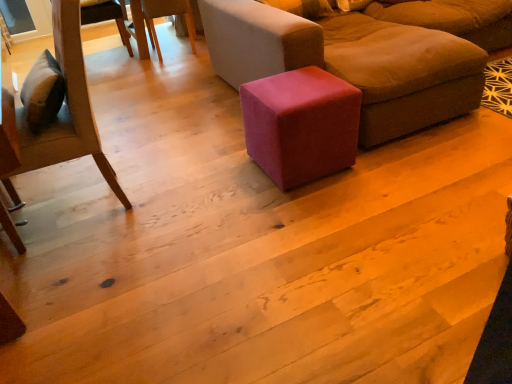
This screenshot has width=512, height=384. What do you see at coordinates (352, 62) in the screenshot?
I see `velvet brown ottoman at center` at bounding box center [352, 62].

What is the approximate height of wooden chair at left, positioned as the second chair in top-to-bottom order?

wooden chair at left, positioned as the second chair in top-to-bottom order, is 38.51 inches tall.

This screenshot has height=384, width=512. What do you see at coordinates (158, 17) in the screenshot? I see `wooden chair at upper left, marked as the second chair in a front-to-back arrangement` at bounding box center [158, 17].

Identify the location of velvet brown ottoman at center. The image size is (512, 384). (352, 62).

Which point is more distant from viewer, (457,47) or (271,174)?

The point (457,47) is farther from the camera.

How distant is velvet brown ottoman at center from velvet pink cube at center?

A distance of 16.63 inches exists between velvet brown ottoman at center and velvet pink cube at center.

From the image's perspective, would you say velvet brown ottoman at center is shown under velvet pink cube at center?

No, from the image's perspective, velvet brown ottoman at center is not beneath velvet pink cube at center.

What's the angular difference between velvet brown ottoman at center and velvet pink cube at center's facing directions?

The angular difference between velvet brown ottoman at center and velvet pink cube at center is 87.5 degrees.

Is velvet pink cube at center behind velvet brown ottoman at center?

Yes, it is behind velvet brown ottoman at center.

Can you confirm if velvet pink cube at center is positioned to the right of velvet brown ottoman at center?

No.

Is velvet pink cube at center next to velvet brown ottoman at center and touching it?

There is a gap between velvet pink cube at center and velvet brown ottoman at center.

Based on their sizes in the image, would you say velvet brown ottoman at center is bigger or smaller than wooden chair at left, which is the first chair from bottom to top?

Considering their sizes, velvet brown ottoman at center takes up more space than wooden chair at left, which is the first chair from bottom to top.

Would you say velvet brown ottoman at center is outside wooden chair at left, which is the first chair from bottom to top?

Yes, velvet brown ottoman at center is located beyond the bounds of wooden chair at left, which is the first chair from bottom to top.

Is velvet brown ottoman at center turned away from wooden chair at left, positioned as the second chair in top-to-bottom order?

No, velvet brown ottoman at center is not facing away from wooden chair at left, positioned as the second chair in top-to-bottom order.

From a real-world perspective, who is located higher, velvet brown ottoman at center or wooden chair at left, positioned as the second chair in top-to-bottom order?

wooden chair at left, positioned as the second chair in top-to-bottom order, is physically above.

Which point is more distant from viewer, [20,152] or [405,48]?

The point [405,48] is more distant.

Is wooden chair at left, which is the first chair from bottom to top, wider or thinner than velvet brown ottoman at center?

In the image, wooden chair at left, which is the first chair from bottom to top, appears to be more narrow than velvet brown ottoman at center.

Looking at the image, does wooden chair at left, positioned as the second chair in top-to-bottom order, seem bigger or smaller compared to velvet brown ottoman at center?

Considering their sizes, wooden chair at left, positioned as the second chair in top-to-bottom order, takes up less space than velvet brown ottoman at center.

Consider the image. How many degrees apart are the facing directions of wooden chair at left, which is the first chair from bottom to top, and wooden chair at upper left, marked as the second chair in a front-to-back arrangement?

There is a 99.1-degree angle between the facing directions of wooden chair at left, which is the first chair from bottom to top, and wooden chair at upper left, marked as the second chair in a front-to-back arrangement.

Is wooden chair at left, the second chair in the back-to-front sequence, oriented towards wooden chair at upper left, the 1th chair positioned from the back?

No, wooden chair at left, the second chair in the back-to-front sequence, is not oriented towards wooden chair at upper left, the 1th chair positioned from the back.

Could you measure the distance between wooden chair at left, the second chair in the back-to-front sequence, and wooden chair at upper left, the 1th chair positioned from the back?

wooden chair at left, the second chair in the back-to-front sequence, and wooden chair at upper left, the 1th chair positioned from the back, are 2.27 meters apart.

Does wooden chair at left, the second chair in the back-to-front sequence, have a greater width compared to wooden chair at upper left, placed as the 2th chair when sorted from bottom to top?

Yes, wooden chair at left, the second chair in the back-to-front sequence, is wider than wooden chair at upper left, placed as the 2th chair when sorted from bottom to top.

Does point (161, 7) appear closer or farther from the camera than point (462, 39)?

Point (161, 7).

Which object is further away from the camera, wooden chair at upper left, the 1th chair positioned from the back, or velvet brown ottoman at center?

wooden chair at upper left, the 1th chair positioned from the back, is behind.

Who is smaller, wooden chair at upper left, the 1th chair positioned from the top, or velvet brown ottoman at center?

Smaller between the two is wooden chair at upper left, the 1th chair positioned from the top.

Is wooden chair at upper left, the 1th chair positioned from the top, looking in the opposite direction of velvet brown ottoman at center?

No, wooden chair at upper left, the 1th chair positioned from the top, is not facing the opposite direction of velvet brown ottoman at center.

From the image's perspective, between wooden chair at upper left, placed as the 2th chair when sorted from bottom to top, and velvet pink cube at center, which one is located above?

wooden chair at upper left, placed as the 2th chair when sorted from bottom to top.

Does wooden chair at upper left, the 1th chair positioned from the back, have a greater width compared to velvet pink cube at center?

Yes, wooden chair at upper left, the 1th chair positioned from the back, is wider than velvet pink cube at center.

Are wooden chair at upper left, the 1th chair positioned from the back, and velvet pink cube at center far apart?

Yes.

Is wooden chair at upper left, the 1th chair positioned from the back, positioned behind velvet pink cube at center?

Yes, the depth of wooden chair at upper left, the 1th chair positioned from the back, is greater than that of velvet pink cube at center.

I want to click on stool on the left of velvet brown ottoman at center, so click(301, 125).

Where is `studio couch above the velvet pink cube at center (from a real-world perspective)`? studio couch above the velvet pink cube at center (from a real-world perspective) is located at coordinates (352, 62).

When comparing their distances from velvet pink cube at center, does velvet brown ottoman at center or wooden chair at upper left, marked as the second chair in a front-to-back arrangement, seem further?

wooden chair at upper left, marked as the second chair in a front-to-back arrangement.

Considering their positions, is velvet brown ottoman at center positioned further to velvet pink cube at center than wooden chair at left, positioned as the second chair in top-to-bottom order?

wooden chair at left, positioned as the second chair in top-to-bottom order, is positioned further to the anchor velvet pink cube at center.

Which object lies further to the anchor point wooden chair at left, the second chair in the back-to-front sequence, wooden chair at upper left, the 1th chair positioned from the back, or velvet brown ottoman at center?

wooden chair at upper left, the 1th chair positioned from the back, is positioned further to the anchor wooden chair at left, the second chair in the back-to-front sequence.

From the image, which object appears to be nearer to wooden chair at left, which appears as the 1th chair when viewed from the front, velvet brown ottoman at center or wooden chair at upper left, the 1th chair positioned from the top?

The object closer to wooden chair at left, which appears as the 1th chair when viewed from the front, is velvet brown ottoman at center.

Estimate the real-world distances between objects in this image. Which object is closer to velvet brown ottoman at center, wooden chair at left, which appears as the 1th chair when viewed from the front, or wooden chair at upper left, the 1th chair positioned from the top?

wooden chair at left, which appears as the 1th chair when viewed from the front, is positioned closer to the anchor velvet brown ottoman at center.

In the scene shown: Considering their positions, is velvet pink cube at center positioned further to wooden chair at left, which appears as the 1th chair when viewed from the front, than velvet brown ottoman at center?

velvet brown ottoman at center.

When comparing their distances from wooden chair at upper left, placed as the 2th chair when sorted from bottom to top, does velvet brown ottoman at center or velvet pink cube at center seem further?

Among the two, velvet pink cube at center is located further to wooden chair at upper left, placed as the 2th chair when sorted from bottom to top.

From the image, which object appears to be farther from wooden chair at left, which is the first chair from bottom to top, wooden chair at upper left, marked as the second chair in a front-to-back arrangement, or velvet pink cube at center?

The object further to wooden chair at left, which is the first chair from bottom to top, is wooden chair at upper left, marked as the second chair in a front-to-back arrangement.

Locate an element on the screen. This screenshot has width=512, height=384. stool between wooden chair at left, the second chair in the back-to-front sequence, and velvet brown ottoman at center, in the horizontal direction is located at coordinates (301, 125).

Where is `stool between wooden chair at left, which appears as the 1th chair when viewed from the front, and wooden chair at upper left, the 1th chair positioned from the top, in the front-back direction`? Image resolution: width=512 pixels, height=384 pixels. stool between wooden chair at left, which appears as the 1th chair when viewed from the front, and wooden chair at upper left, the 1th chair positioned from the top, in the front-back direction is located at coordinates (301, 125).

Find the location of a particular element. This screenshot has width=512, height=384. studio couch between wooden chair at left, the second chair in the back-to-front sequence, and wooden chair at upper left, the 1th chair positioned from the top, from front to back is located at coordinates point(352,62).

What are the coordinates of `stool positioned between velvet brown ottoman at center and wooden chair at upper left, the 1th chair positioned from the back, from near to far` in the screenshot? It's located at (301, 125).